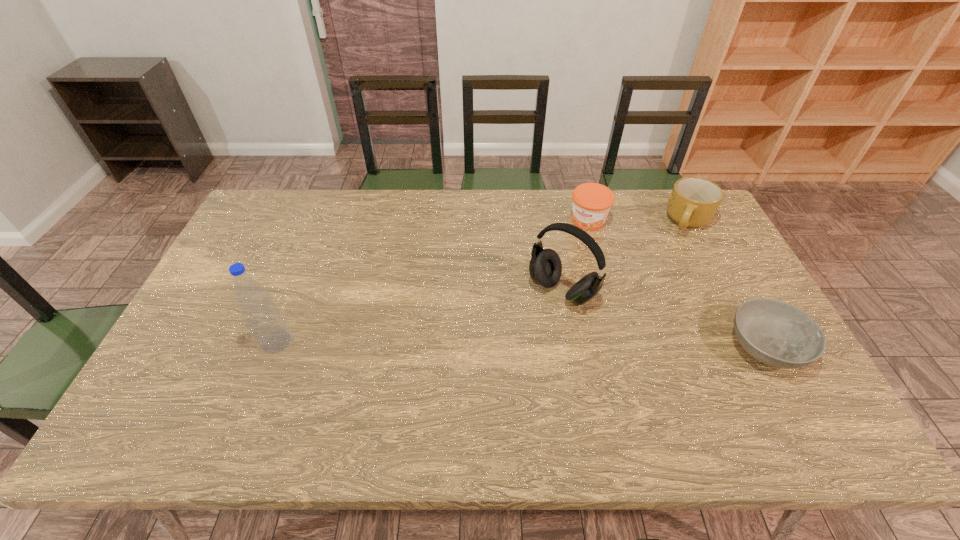
At what (x,y) coordinates should I click in order to perform the action: click on the tallest object. Please return your answer as a coordinate pair (x, y). Looking at the image, I should click on (265, 322).

This screenshot has height=540, width=960. What are the coordinates of `the leftmost object` in the screenshot? It's located at (265, 322).

Where is `the shortest object`? the shortest object is located at coordinates click(x=776, y=333).

Locate an element on the screen. Image resolution: width=960 pixels, height=540 pixels. headset is located at coordinates (545, 268).

What are the coordinates of `jam` in the screenshot? It's located at (591, 202).

Locate an element on the screen. Image resolution: width=960 pixels, height=540 pixels. mug is located at coordinates (693, 203).

Identify the location of free point located 0.130m on the back of the water bottle. Image resolution: width=960 pixels, height=540 pixels. (295, 294).

This screenshot has width=960, height=540. I want to click on free space located on the left of the bowl, so click(665, 347).

Identify the location of free space located on the ear cups of the second tallest object. This screenshot has height=540, width=960. (533, 321).

This screenshot has height=540, width=960. Identify the location of vacant region located 0.360m on the ear cups of the second tallest object. (458, 400).